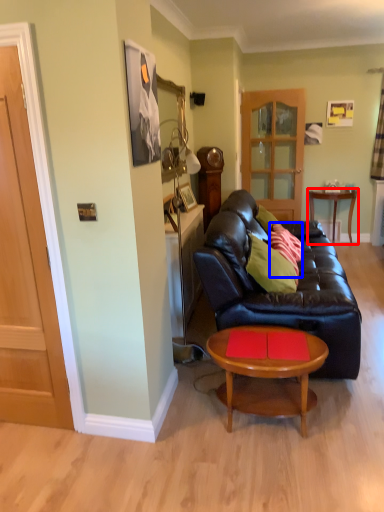
Question: Among these objects, which one is nearest to the camera, table (highlighted by a red box) or pillow (highlighted by a blue box)?

Choices:
 (A) table
 (B) pillow

Answer: (B)